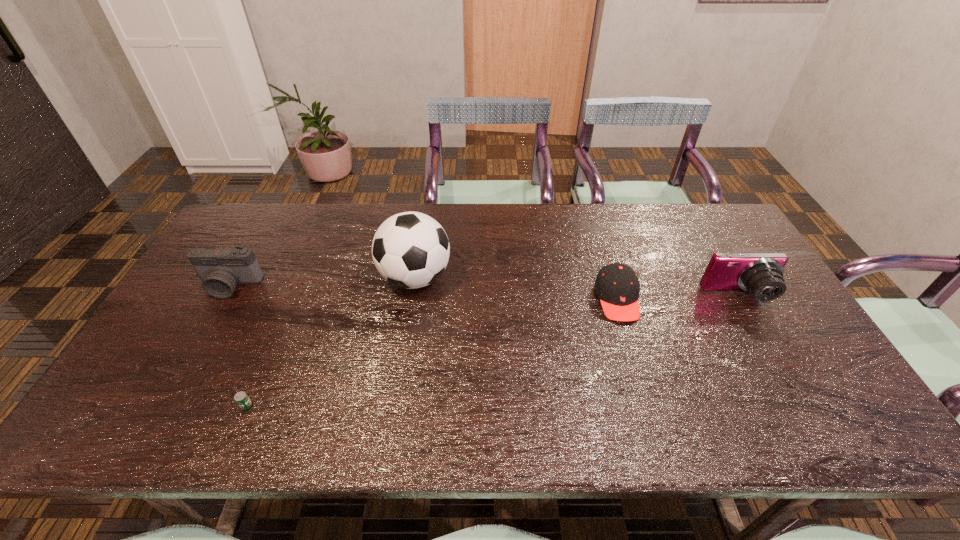
Image resolution: width=960 pixels, height=540 pixels. What are the coordinates of `free region located at the lens of the leftmost object` in the screenshot? It's located at (182, 370).

This screenshot has height=540, width=960. I want to click on vacant space located 0.330m on the front-facing side of the second object from right to left, so click(x=660, y=440).

Locate an element on the screen. The height and width of the screenshot is (540, 960). free spot located on the back of the shortest object is located at coordinates (262, 367).

This screenshot has height=540, width=960. Find the location of `object present at the near edge`. object present at the near edge is located at coordinates (241, 398).

This screenshot has height=540, width=960. What are the coordinates of `object situated at the left edge` in the screenshot? It's located at (221, 269).

Locate an element on the screen. This screenshot has width=960, height=540. object located at the right edge is located at coordinates (761, 274).

Locate an element on the screen. The height and width of the screenshot is (540, 960). vacant space at the far edge of the desktop is located at coordinates (300, 227).

The height and width of the screenshot is (540, 960). I want to click on vacant space at the near edge, so (x=326, y=417).

This screenshot has width=960, height=540. In the image, there is a desktop. What are the coordinates of `vacant space at the near left corner` in the screenshot? It's located at (151, 429).

The image size is (960, 540). In order to click on free location at the far right corner of the desktop in this screenshot , I will do `click(691, 207)`.